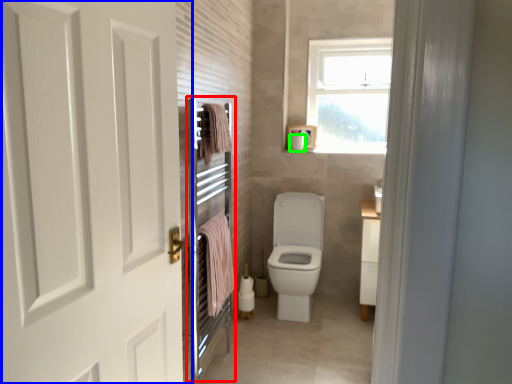
Question: Estimate the real-world distances between objects in this image. Which object is farther from screen door (highlighted by a red box), door (highlighted by a blue box) or toilet paper (highlighted by a green box)?

Choices:
 (A) door
 (B) toilet paper

Answer: (B)